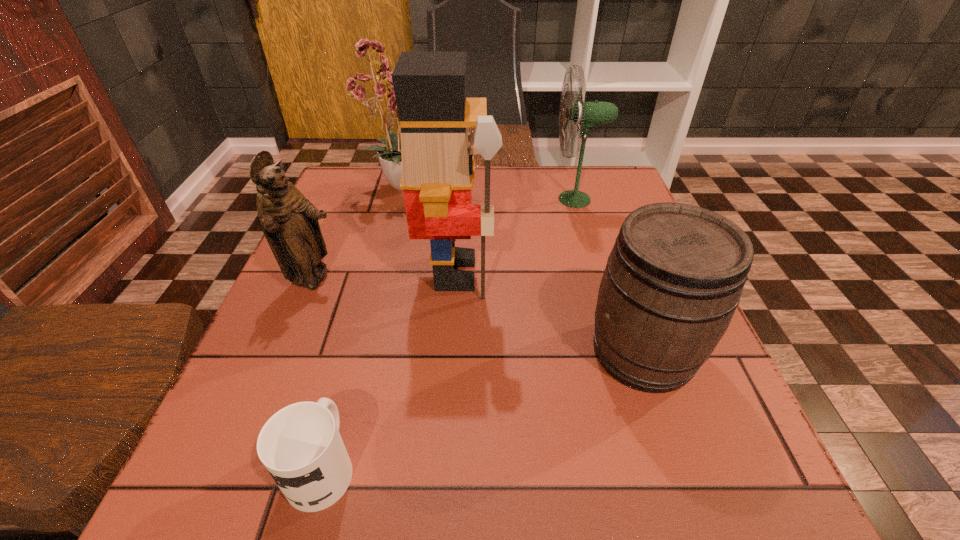
This screenshot has width=960, height=540. Find the location of `nutcracker`. nutcracker is located at coordinates (438, 168).

What are the coordinates of `flower arrangement` in the screenshot? It's located at (376, 102).

Locate an element on the screen. This screenshot has height=540, width=960. fan is located at coordinates (586, 115).

In order to click on figurine in this screenshot , I will do click(289, 221).

You are a GUI agent. You are given a task and a screenshot of the screen. Output one action in this format:
    pyautogui.click(x=<x>, y=<y>)
    Task: Click on the fifth farthest object
    Image resolution: width=960 pixels, height=540 pixels.
    Given the screenshot: What is the action you would take?
    pyautogui.click(x=674, y=278)

Where is `the shortest object`? The height and width of the screenshot is (540, 960). the shortest object is located at coordinates (301, 447).

Find the location of a particular element. the nearest object is located at coordinates (301, 447).

Image resolution: width=960 pixels, height=540 pixels. In order to click on free point located in front of the nutcracker holding the staff in this screenshot , I will do `click(606, 273)`.

The width and height of the screenshot is (960, 540). In order to click on free point located 0.240m on the front-facing side of the flower arrangement in this screenshot , I will do `click(545, 184)`.

You are a GUI agent. You are given a task and a screenshot of the screen. Output one action in this format:
    pyautogui.click(x=<x>, y=<y>)
    Task: Click on the vacant area situated on the front-facing side of the fan
    
    Given the screenshot: What is the action you would take?
    pyautogui.click(x=396, y=199)